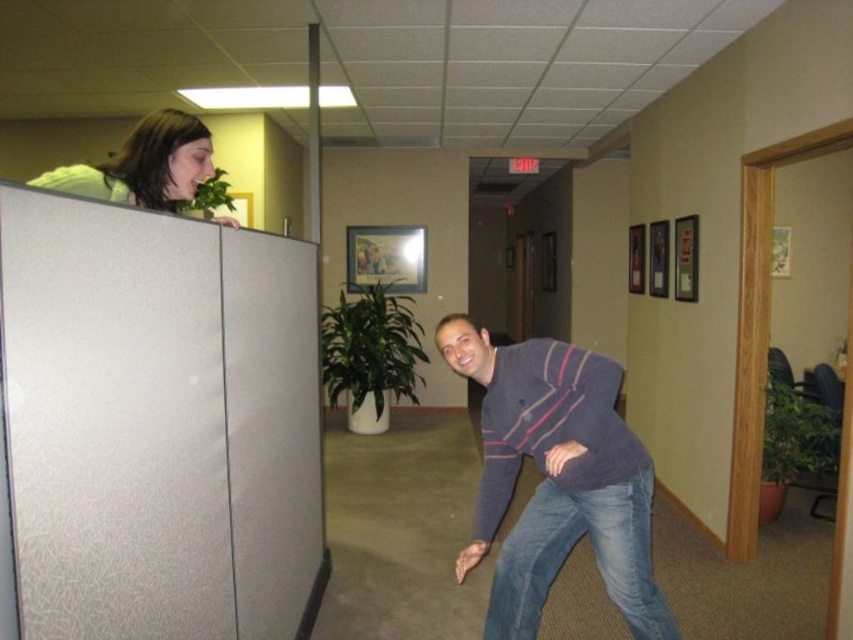
You are standing at point (175,128) and want to walk to point (544,497). According to the scene, will you have to go around any obstacles or can you walk straight?

Point (544,497) is behind point (175,128), so you will have to go around obstacles to reach it because it is not in a straight path.

You are an office worker who needs to determine the spatial relationship between the dark blue sweater at center and the matte white hair at upper left. Which object is wider?

The dark blue sweater at center is wider than the matte white hair at upper left.

You are an office worker who needs to locate the person wearing the dark blue sweater at center. Where should you look relative to the matte white hair at upper left?

The dark blue sweater at center is located below the matte white hair at upper left, so you should look downward from the matte white hair at upper left to find it.